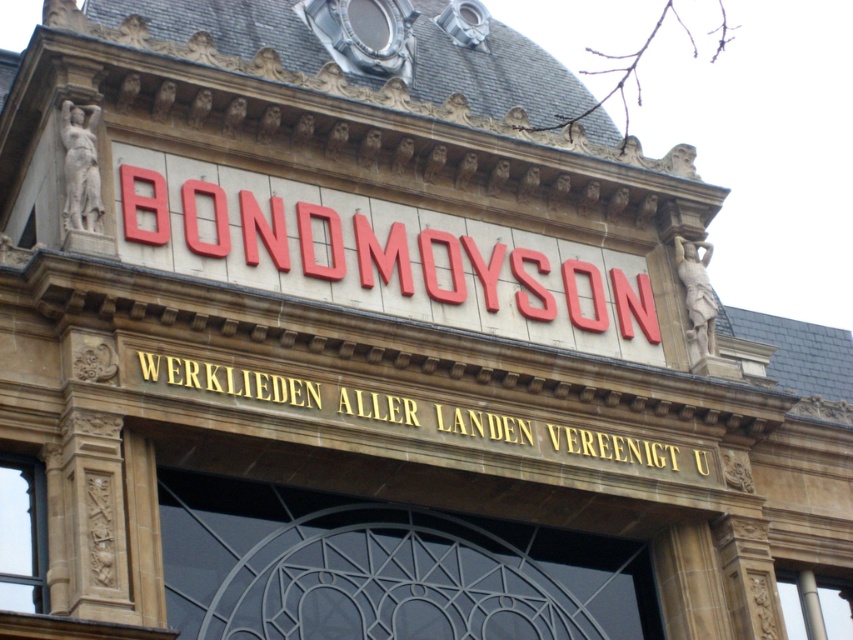
You are standing in front of the building and notice two points marked on its facade. The first point is at coordinates point (257,234) and the second at point (698,464). Which point is closer to you as you face the building?

The point at (257,234) is closer to you because it is in front of the point at (698,464).